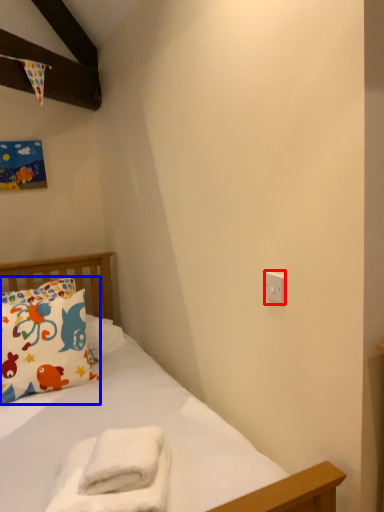
Question: Which of the following is the closest to the observer, electric outlet (highlighted by a red box) or pillow (highlighted by a blue box)?

Choices:
 (A) electric outlet
 (B) pillow

Answer: (A)